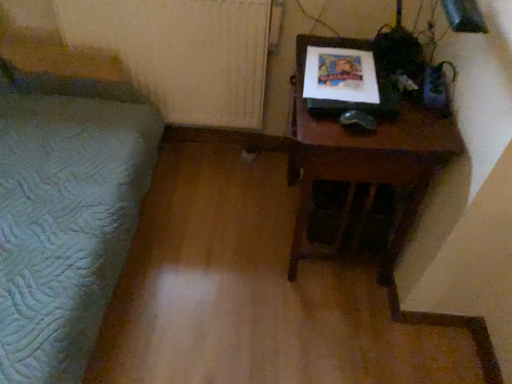
You are a GUI agent. You are given a task and a screenshot of the screen. Output one action in this format:
    pyautogui.click(x=<x>, y=<y>)
    Task: Click on the vacant space underneath white textured radiator at upper left (from a real-world perspective)
    This screenshot has width=512, height=384.
    Given the screenshot: What is the action you would take?
    pyautogui.click(x=202, y=148)